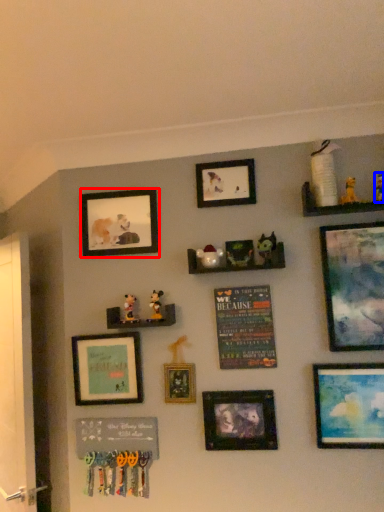
Question: Which object appears closest to the camera in this image, picture frame (highlighted by a red box) or toy (highlighted by a blue box)?

Choices:
 (A) picture frame
 (B) toy

Answer: (B)